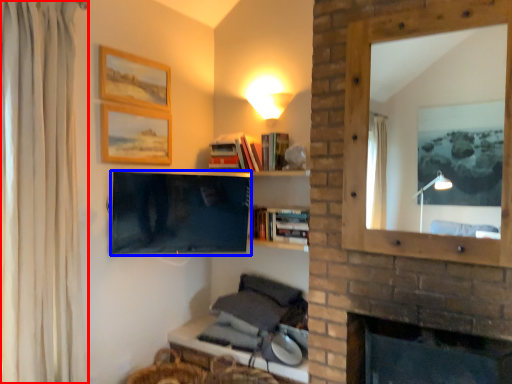
Question: Which object appears farthest to the camera in this image, curtain (highlighted by a red box) or television (highlighted by a blue box)?

Choices:
 (A) curtain
 (B) television

Answer: (B)